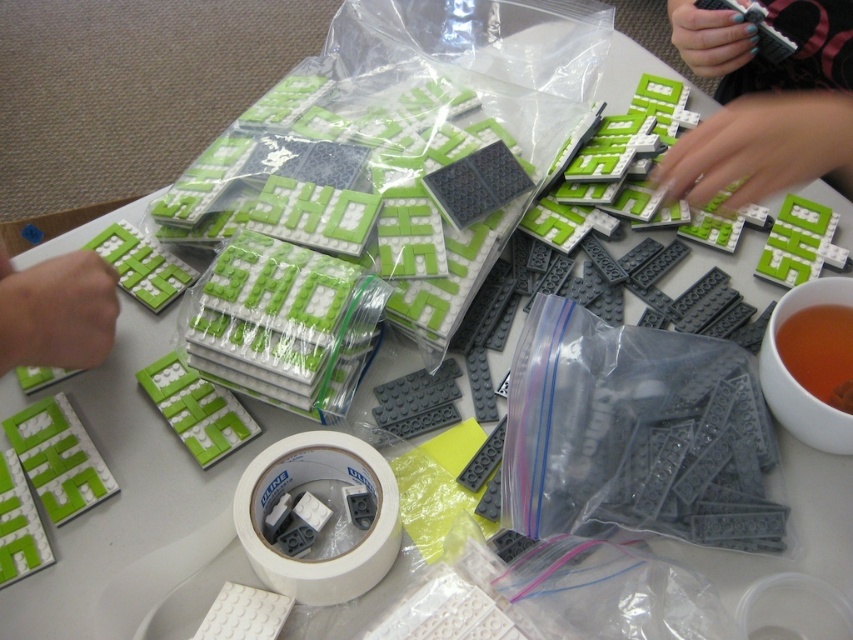
Where is the green matte lego brick at upper right located in the image?

The green matte lego brick at upper right is located at point (763, 102) in the image.

You are trying to locate the green matte lego brick at upper right and the matte green plastic lego at lower left on the table. Which one is positioned more to the right side of the table?

The green matte lego brick at upper right is positioned more to the right side of the table than the matte green plastic lego at lower left.

From the picture: You are a worker organizing LEGO bricks. You need to place the green matte lego brick at upper right and the brown liquid at lower right in their correct positions. According to the current arrangement, which object is located to the right side?

The green matte lego brick at upper right is to the right of the brown liquid at lower right, so the green matte lego brick at upper right is located to the right side.